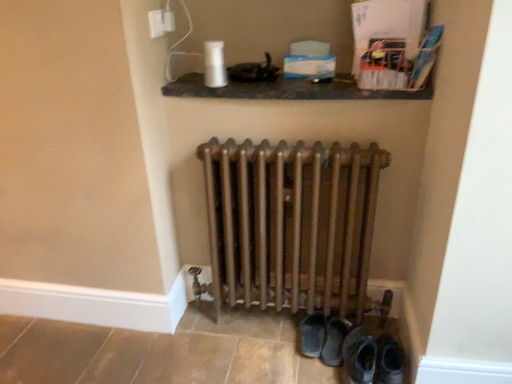
Measure the distance between point (x=263, y=88) and camera.

Point (x=263, y=88) is 1.45 meters away from camera.

This screenshot has width=512, height=384. What do you see at coordinates (312, 335) in the screenshot?
I see `dark brown leather shoes at lower center, which is the first footwear in left-to-right order` at bounding box center [312, 335].

At what (x,y) coordinates should I click in order to perform the action: click on matte black shelf at upper center. Please return your answer as a coordinate pair (x, y). Looking at the image, I should click on (290, 90).

Is white plastic electric outlet at upper center facing towards matte black shelf at upper center?

No.

Is white plastic electric outlet at upper center situated inside matte black shelf at upper center or outside?

white plastic electric outlet at upper center is spatially situated outside matte black shelf at upper center.

Considering the relative positions of white plastic electric outlet at upper center and matte black shelf at upper center in the image provided, is white plastic electric outlet at upper center to the left of matte black shelf at upper center from the viewer's perspective?

Correct, you'll find white plastic electric outlet at upper center to the left of matte black shelf at upper center.

Can you tell me how much white plastic electric outlet at upper center and matte black shelf at upper center differ in facing direction?

The angular difference between white plastic electric outlet at upper center and matte black shelf at upper center is 89.8 degrees.

Based on the photo, would you say leather boot at lower right, the 1th footwear when ordered from right to left, is inside or outside dark brown leather shoes at lower center, which is the first footwear in left-to-right order?

Answer: leather boot at lower right, the 1th footwear when ordered from right to left, is not enclosed by dark brown leather shoes at lower center, which is the first footwear in left-to-right order.

Considering the sizes of leather boot at lower right, which appears as the 2th footwear when viewed from the left, and dark brown leather shoes at lower center, which is the first footwear in left-to-right order, in the image, is leather boot at lower right, which appears as the 2th footwear when viewed from the left, taller or shorter than dark brown leather shoes at lower center, which is the first footwear in left-to-right order,?

In the image, leather boot at lower right, which appears as the 2th footwear when viewed from the left, appears to be taller than dark brown leather shoes at lower center, which is the first footwear in left-to-right order.

Is leather boot at lower right, which appears as the 2th footwear when viewed from the left, positioned far away from dark brown leather shoes at lower center, positioned as the 2th footwear in right-to-left order?

That's not correct — leather boot at lower right, which appears as the 2th footwear when viewed from the left, is a little close to dark brown leather shoes at lower center, positioned as the 2th footwear in right-to-left order.

From the image's perspective, between leather boot at lower right, which appears as the 2th footwear when viewed from the left, and dark brown leather shoes at lower center, positioned as the 2th footwear in right-to-left order, which one is located above?

leather boot at lower right, which appears as the 2th footwear when viewed from the left, appears higher in the image.

Looking at this image, can you confirm if matte black shelf at upper center is taller than white plastic electric outlet at upper center?

Incorrect, the height of matte black shelf at upper center is not larger of that of white plastic electric outlet at upper center.

You are a GUI agent. You are given a task and a screenshot of the screen. Output one action in this format:
    pyautogui.click(x=<x>, y=<y>)
    Task: Click on the electric outlet that is above the matte black shelf at upper center (from the image's perspective)
    Image resolution: width=512 pixels, height=384 pixels.
    Given the screenshot: What is the action you would take?
    pyautogui.click(x=161, y=22)

Which is farther from the camera, (x=335, y=97) or (x=167, y=24)?

The point (x=167, y=24) is farther.

Considering the positions of objects matte black shelf at upper center and leather boot at lower right, which appears as the 2th footwear when viewed from the left, in the image provided, who is behind, matte black shelf at upper center or leather boot at lower right, which appears as the 2th footwear when viewed from the left,?

matte black shelf at upper center is further away from the camera.

Is matte black shelf at upper center beside leather boot at lower right, the 1th footwear when ordered from right to left?

matte black shelf at upper center and leather boot at lower right, the 1th footwear when ordered from right to left, are clearly separated.

Is matte black shelf at upper center turned away from leather boot at lower right, the 1th footwear when ordered from right to left?

No, matte black shelf at upper center is not facing the opposite direction of leather boot at lower right, the 1th footwear when ordered from right to left.

Looking at this image, between matte black shelf at upper center and leather boot at lower right, which appears as the 2th footwear when viewed from the left, which one has smaller size?

Smaller between the two is leather boot at lower right, which appears as the 2th footwear when viewed from the left.

How many degrees apart are the facing directions of dark brown leather shoes at lower center, positioned as the 2th footwear in right-to-left order, and bronze metallic radiator at center?

There is a 1.83-degree angle between the facing directions of dark brown leather shoes at lower center, positioned as the 2th footwear in right-to-left order, and bronze metallic radiator at center.

From the image's perspective, is dark brown leather shoes at lower center, which is the first footwear in left-to-right order, located beneath bronze metallic radiator at center?

Indeed, from the image's perspective, dark brown leather shoes at lower center, which is the first footwear in left-to-right order, is shown beneath bronze metallic radiator at center.

From a real-world perspective, does dark brown leather shoes at lower center, which is the first footwear in left-to-right order, stand above bronze metallic radiator at center?

Incorrect, from a real-world perspective, dark brown leather shoes at lower center, which is the first footwear in left-to-right order, is lower than bronze metallic radiator at center.

Is dark brown leather shoes at lower center, which is the first footwear in left-to-right order, closer to camera compared to bronze metallic radiator at center?

No.

Is white plastic electric outlet at upper center bigger than bronze metallic radiator at center?

Actually, white plastic electric outlet at upper center might be smaller than bronze metallic radiator at center.

Does white plastic electric outlet at upper center contain bronze metallic radiator at center?

That's incorrect, bronze metallic radiator at center is not inside white plastic electric outlet at upper center.

Is white plastic electric outlet at upper center with bronze metallic radiator at center?

No, white plastic electric outlet at upper center is not beside bronze metallic radiator at center.

Does white plastic electric outlet at upper center turn towards bronze metallic radiator at center?

No, white plastic electric outlet at upper center is not turned towards bronze metallic radiator at center.

From the image's perspective, would you say leather boot at lower right, which appears as the 2th footwear when viewed from the left, is shown under white plastic electric outlet at upper center?

Yes, from the image's perspective, leather boot at lower right, which appears as the 2th footwear when viewed from the left, is below white plastic electric outlet at upper center.

From a real-world perspective, is leather boot at lower right, which appears as the 2th footwear when viewed from the left, physically below white plastic electric outlet at upper center?

Yes, from a real-world perspective, leather boot at lower right, which appears as the 2th footwear when viewed from the left, is under white plastic electric outlet at upper center.

In the scene shown: Is white plastic electric outlet at upper center at the back of leather boot at lower right, which appears as the 2th footwear when viewed from the left?

leather boot at lower right, which appears as the 2th footwear when viewed from the left, is not turned away from white plastic electric outlet at upper center.

In order to click on shelf below the white plastic electric outlet at upper center (from a real-world perspective) in this screenshot , I will do `click(290, 90)`.

The height and width of the screenshot is (384, 512). I want to click on footwear on the right of dark brown leather shoes at lower center, which is the first footwear in left-to-right order, so click(359, 356).

From the image, which object appears to be farther from dark brown leather shoes at lower center, which is the first footwear in left-to-right order, matte black shelf at upper center or bronze metallic radiator at center?

matte black shelf at upper center is positioned further to the anchor dark brown leather shoes at lower center, which is the first footwear in left-to-right order.

Estimate the real-world distances between objects in this image. Which object is further from leather boot at lower right, the 1th footwear when ordered from right to left, dark brown leather shoes at lower center, which is the first footwear in left-to-right order, or white plastic electric outlet at upper center?

Among the two, white plastic electric outlet at upper center is located further to leather boot at lower right, the 1th footwear when ordered from right to left.

From the image, which object appears to be farther from white plastic electric outlet at upper center, bronze metallic radiator at center or matte black shelf at upper center?

bronze metallic radiator at center lies further to white plastic electric outlet at upper center than the other object.

Which object lies nearer to the anchor point bronze metallic radiator at center, white plastic electric outlet at upper center or dark brown leather shoes at lower center, which is the first footwear in left-to-right order?

dark brown leather shoes at lower center, which is the first footwear in left-to-right order.

Which object lies further to the anchor point dark brown leather shoes at lower center, positioned as the 2th footwear in right-to-left order, leather boot at lower right, the 1th footwear when ordered from right to left, or matte black shelf at upper center?

Among the two, matte black shelf at upper center is located further to dark brown leather shoes at lower center, positioned as the 2th footwear in right-to-left order.

Looking at the image, which one is located closer to matte black shelf at upper center, dark brown leather shoes at lower center, which is the first footwear in left-to-right order, or leather boot at lower right, the 1th footwear when ordered from right to left?

dark brown leather shoes at lower center, which is the first footwear in left-to-right order, lies closer to matte black shelf at upper center than the other object.

Based on their spatial positions, is bronze metallic radiator at center or matte black shelf at upper center closer to dark brown leather shoes at lower center, positioned as the 2th footwear in right-to-left order?

Among the two, bronze metallic radiator at center is located nearer to dark brown leather shoes at lower center, positioned as the 2th footwear in right-to-left order.

Looking at the image, which one is located further to dark brown leather shoes at lower center, which is the first footwear in left-to-right order, bronze metallic radiator at center or leather boot at lower right, the 1th footwear when ordered from right to left?

Based on the image, bronze metallic radiator at center appears to be further to dark brown leather shoes at lower center, which is the first footwear in left-to-right order.

Locate an element on the screen. Image resolution: width=512 pixels, height=384 pixels. footwear between white plastic electric outlet at upper center and dark brown leather shoes at lower center, positioned as the 2th footwear in right-to-left order, in the vertical direction is located at coordinates (359, 356).

Where is `radiator between matte black shelf at upper center and leather boot at lower right, the 1th footwear when ordered from right to left, in the vertical direction`? The width and height of the screenshot is (512, 384). radiator between matte black shelf at upper center and leather boot at lower right, the 1th footwear when ordered from right to left, in the vertical direction is located at coordinates (291, 223).

I want to click on radiator between white plastic electric outlet at upper center and leather boot at lower right, which appears as the 2th footwear when viewed from the left, in the up-down direction, so click(291, 223).

In order to click on radiator between white plastic electric outlet at upper center and dark brown leather shoes at lower center, positioned as the 2th footwear in right-to-left order, vertically in this screenshot , I will do `click(291, 223)`.